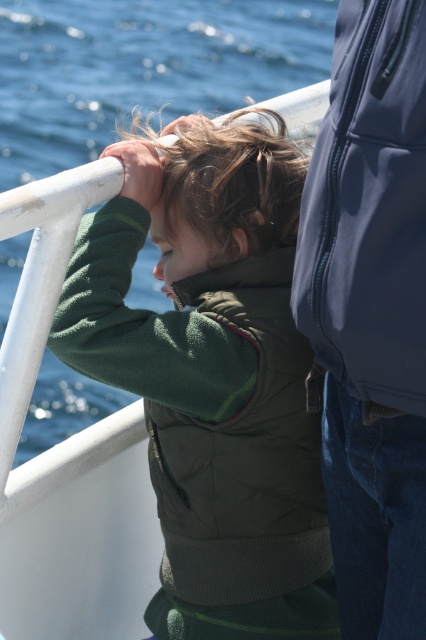
Question: Can you confirm if green fleece jacket at center is positioned to the left of glossy blue jacket at upper right?

Choices:
 (A) no
 (B) yes

Answer: (B)

Question: In this image, where is green fleece jacket at center located relative to glossy blue jacket at upper right?

Choices:
 (A) left
 (B) right

Answer: (A)

Question: Which of the following is the closest to the observer?

Choices:
 (A) (354, 228)
 (B) (109, 326)

Answer: (A)

Question: Which point is closer to the camera?

Choices:
 (A) (213, 612)
 (B) (377, 278)

Answer: (B)

Question: Does green fleece jacket at center appear on the right side of glossy blue jacket at upper right?

Choices:
 (A) no
 (B) yes

Answer: (A)